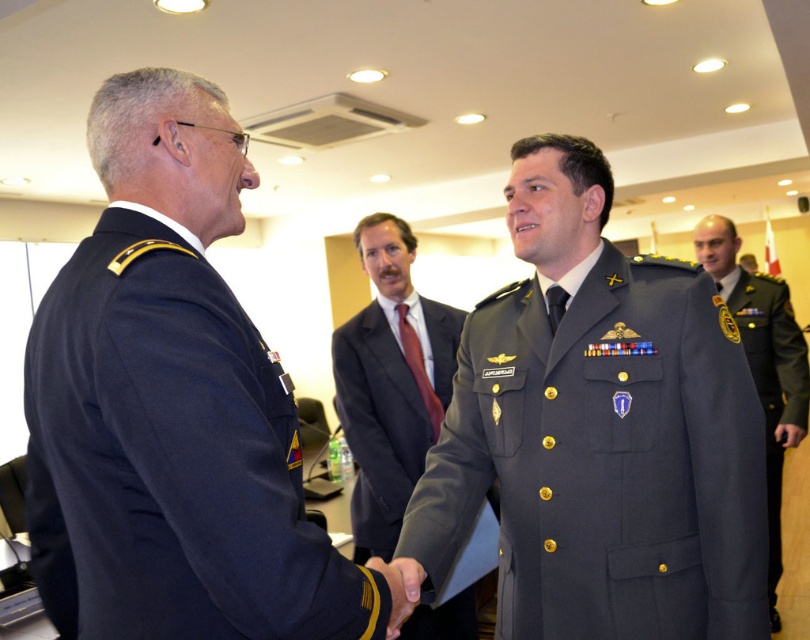
You are a photographer at this event and need to ensure both the navy blue uniform at center and the dark gray suit at center are fully visible in the photo. Based on their positions, which one might require more space in the frame?

The navy blue uniform at center might require more space in the frame since it is wider than the dark gray suit at center according to the description.

You are observing a military ceremony and notice two individuals in uniforms at the center. Which of the two uniforms, the matte gray uniform at center or the dark gray uniform at center, is positioned to the left?

The matte gray uniform at center is positioned to the left of the dark gray uniform at center.